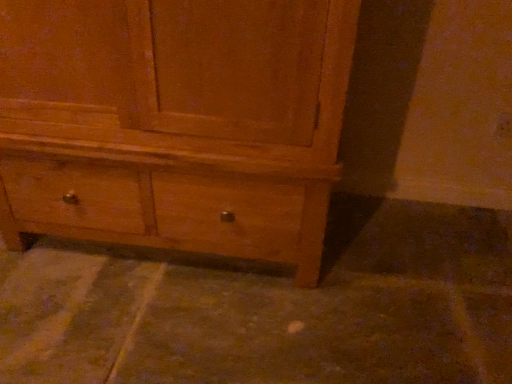
Image resolution: width=512 pixels, height=384 pixels. Describe the element at coordinates (175, 123) in the screenshot. I see `matte wood chest of drawers at center` at that location.

Identify the location of matte wood chest of drawers at center. Image resolution: width=512 pixels, height=384 pixels. (175, 123).

Image resolution: width=512 pixels, height=384 pixels. What do you see at coordinates (271, 307) in the screenshot?
I see `brown concrete at lower center` at bounding box center [271, 307].

Locate an element on the screen. The image size is (512, 384). brown concrete at lower center is located at coordinates (271, 307).

This screenshot has height=384, width=512. Identify the location of matte wood chest of drawers at center. (175, 123).

Considering the positions of objects matte wood chest of drawers at center and brown concrete at lower center in the image provided, who is more to the left, matte wood chest of drawers at center or brown concrete at lower center?

matte wood chest of drawers at center is more to the left.

Considering the positions of objects matte wood chest of drawers at center and brown concrete at lower center in the image provided, who is in front, matte wood chest of drawers at center or brown concrete at lower center?

Positioned in front is matte wood chest of drawers at center.

Which is behind, point (45, 115) or point (417, 341)?

Point (417, 341)

From the image's perspective, which is below, matte wood chest of drawers at center or brown concrete at lower center?

brown concrete at lower center is shown below in the image.

From a real-world perspective, is matte wood chest of drawers at center positioned above or below brown concrete at lower center?

matte wood chest of drawers at center is situated higher than brown concrete at lower center in the real world.

Can you confirm if matte wood chest of drawers at center is wider than brown concrete at lower center?

Incorrect, the width of matte wood chest of drawers at center does not surpass that of brown concrete at lower center.

Is matte wood chest of drawers at center taller or shorter than brown concrete at lower center?

In the image, matte wood chest of drawers at center appears to be taller than brown concrete at lower center.

Which of these two, matte wood chest of drawers at center or brown concrete at lower center, is smaller?

brown concrete at lower center.

From the picture: Could brown concrete at lower center be considered to be inside matte wood chest of drawers at center?

No, brown concrete at lower center is located outside of matte wood chest of drawers at center.

Is matte wood chest of drawers at center touching brown concrete at lower center?

No, matte wood chest of drawers at center is not in contact with brown concrete at lower center.

Could you tell me if matte wood chest of drawers at center is turned towards brown concrete at lower center?

No.

How many degrees apart are the facing directions of matte wood chest of drawers at center and brown concrete at lower center?

The angle between the facing direction of matte wood chest of drawers at center and the facing direction of brown concrete at lower center is 180 degrees.

Where is `concrete below the matte wood chest of drawers at center (from a real-world perspective)`? The image size is (512, 384). concrete below the matte wood chest of drawers at center (from a real-world perspective) is located at coordinates tap(271, 307).

Is brown concrete at lower center to the left or to the right of matte wood chest of drawers at center in the image?

brown concrete at lower center is positioned on matte wood chest of drawers at center's right side.

Is brown concrete at lower center positioned before matte wood chest of drawers at center?

No, brown concrete at lower center is further to the viewer.

Which is behind, point (323, 351) or point (302, 123)?

The point (323, 351) is farther.

From the image's perspective, which one is positioned lower, brown concrete at lower center or matte wood chest of drawers at center?

brown concrete at lower center.

From a real-world perspective, is brown concrete at lower center below matte wood chest of drawers at center?

Yes, from a real-world perspective, brown concrete at lower center is under matte wood chest of drawers at center.

Considering the sizes of objects brown concrete at lower center and matte wood chest of drawers at center in the image provided, who is wider, brown concrete at lower center or matte wood chest of drawers at center?

brown concrete at lower center.

Does brown concrete at lower center have a greater height compared to matte wood chest of drawers at center?

In fact, brown concrete at lower center may be shorter than matte wood chest of drawers at center.

In terms of size, does brown concrete at lower center appear bigger or smaller than matte wood chest of drawers at center?

In the image, brown concrete at lower center appears to be smaller than matte wood chest of drawers at center.

Is matte wood chest of drawers at center surrounded by brown concrete at lower center?

No, matte wood chest of drawers at center is located outside of brown concrete at lower center.

Is brown concrete at lower center in contact with matte wood chest of drawers at center?

brown concrete at lower center and matte wood chest of drawers at center are not in contact.

Does brown concrete at lower center turn towards matte wood chest of drawers at center?

No.

You are a GUI agent. You are given a task and a screenshot of the screen. Output one action in this format:
    pyautogui.click(x=<x>, y=<y>)
    Task: Click on the concrete on the right of matte wood chest of drawers at center
    
    Given the screenshot: What is the action you would take?
    pyautogui.click(x=271, y=307)

This screenshot has height=384, width=512. In order to click on chest of drawers in front of the brown concrete at lower center in this screenshot , I will do pos(175,123).

Locate an element on the screen. Image resolution: width=512 pixels, height=384 pixels. concrete below the matte wood chest of drawers at center (from the image's perspective) is located at coordinates (271, 307).